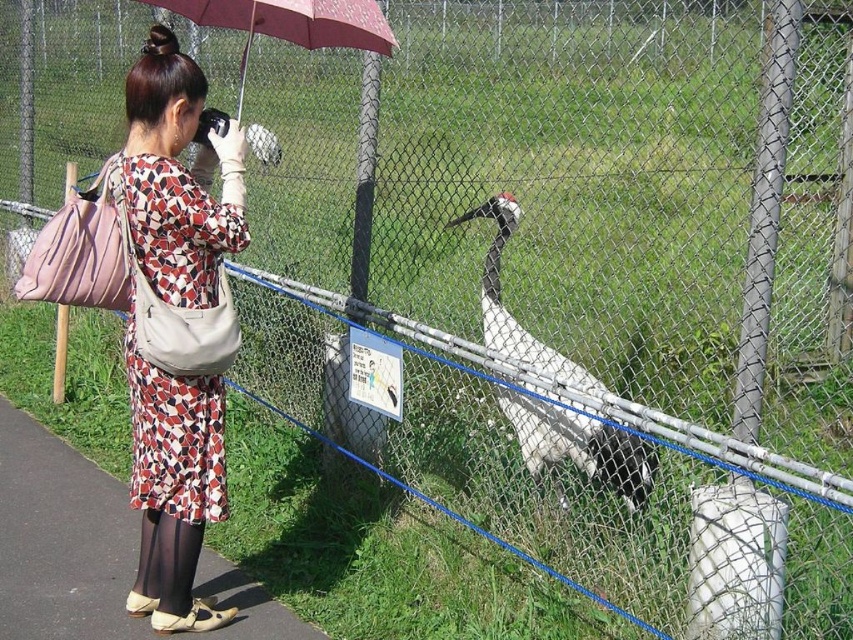
Question: Is white glossy bird at center wider than maroon fabric umbrella at upper center?

Choices:
 (A) no
 (B) yes

Answer: (A)

Question: Can you confirm if white glossy bird at center is positioned to the right of maroon fabric umbrella at upper center?

Choices:
 (A) no
 (B) yes

Answer: (B)

Question: Is white glossy bird at center positioned behind maroon fabric umbrella at upper center?

Choices:
 (A) yes
 (B) no

Answer: (A)

Question: Based on their relative distances, which object is farther from the white glossy bird at center?

Choices:
 (A) maroon fabric umbrella at upper center
 (B) printed fabric dress at center

Answer: (B)

Question: Which object appears closest to the camera in this image?

Choices:
 (A) white glossy bird at center
 (B) printed fabric dress at center

Answer: (B)

Question: Which of the following is the farthest from the observer?

Choices:
 (A) maroon fabric umbrella at upper center
 (B) printed fabric dress at center
 (C) white glossy bird at center

Answer: (C)